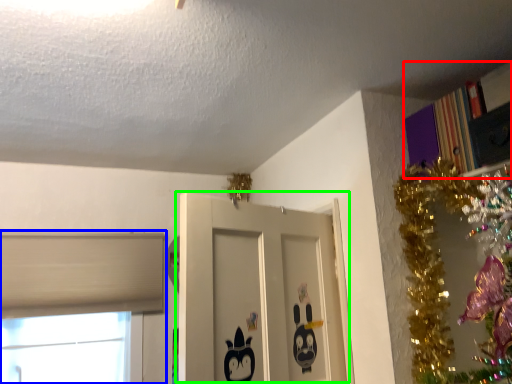
Question: Based on their relative distances, which object is farther from bookcase (highlighted by a red box)? Choose from window (highlighted by a blue box) and door (highlighted by a green box).

Choices:
 (A) window
 (B) door

Answer: (A)